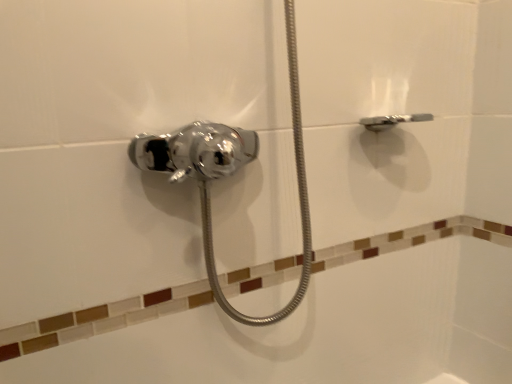
Describe the element at coordinates (322, 330) in the screenshot. This screenshot has height=384, width=512. I see `satin nickel showerhead at center` at that location.

At what (x,y) coordinates should I click in order to perform the action: click on satin nickel showerhead at center. Please return your answer as a coordinate pair (x, y). The width and height of the screenshot is (512, 384). Looking at the image, I should click on (322, 330).

At what (x,y) coordinates should I click in order to perform the action: click on satin nickel showerhead at center. Please return your answer as a coordinate pair (x, y). The width and height of the screenshot is (512, 384). Looking at the image, I should click on (322, 330).